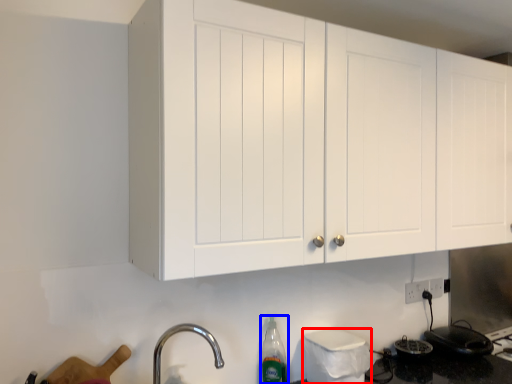
Question: Among these objects, which one is farthest to the camera, appliance (highlighted by a red box) or bottle (highlighted by a blue box)?

Choices:
 (A) appliance
 (B) bottle

Answer: (B)